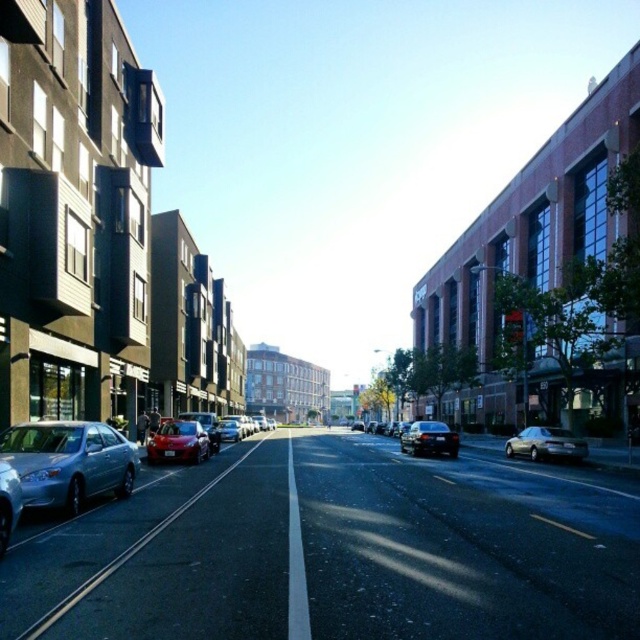
Question: Does satin silver sedan at left appear over shiny silver sedan at center?

Choices:
 (A) no
 (B) yes

Answer: (B)

Question: Which object is closer to the camera taking this photo?

Choices:
 (A) shiny red car at left
 (B) shiny silver sedan at center
 (C) shiny black sedan at center
 (D) shiny red sedan at center

Answer: (A)

Question: Can you confirm if shiny red car at left is positioned to the left of shiny red sedan at center?

Choices:
 (A) no
 (B) yes

Answer: (B)

Question: Which object appears farthest from the camera in this image?

Choices:
 (A) shiny black sedan at center
 (B) shiny silver sedan at center
 (C) satin silver sedan at left
 (D) shiny red car at left

Answer: (A)

Question: Which of the following is the farthest from the observer?

Choices:
 (A) (100, 490)
 (B) (435, 451)
 (C) (557, 449)

Answer: (B)

Question: Can you confirm if shiny red car at left is positioned below shiny black sedan at center?

Choices:
 (A) no
 (B) yes

Answer: (A)